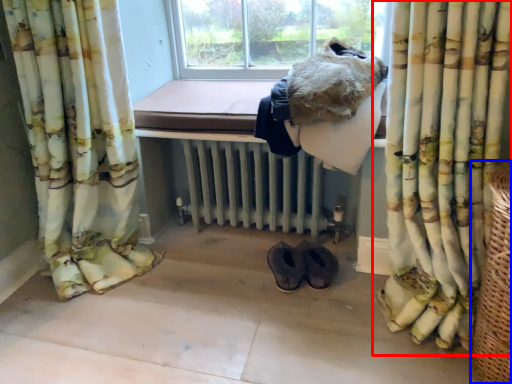
Question: Which object is closer to the camera taking this photo, curtain (highlighted by a red box) or basket (highlighted by a blue box)?

Choices:
 (A) curtain
 (B) basket

Answer: (B)